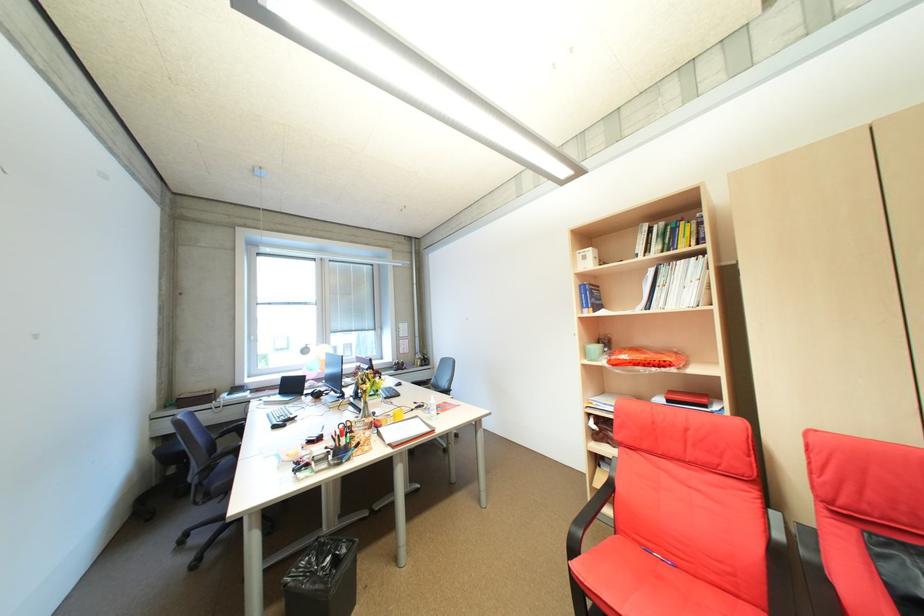
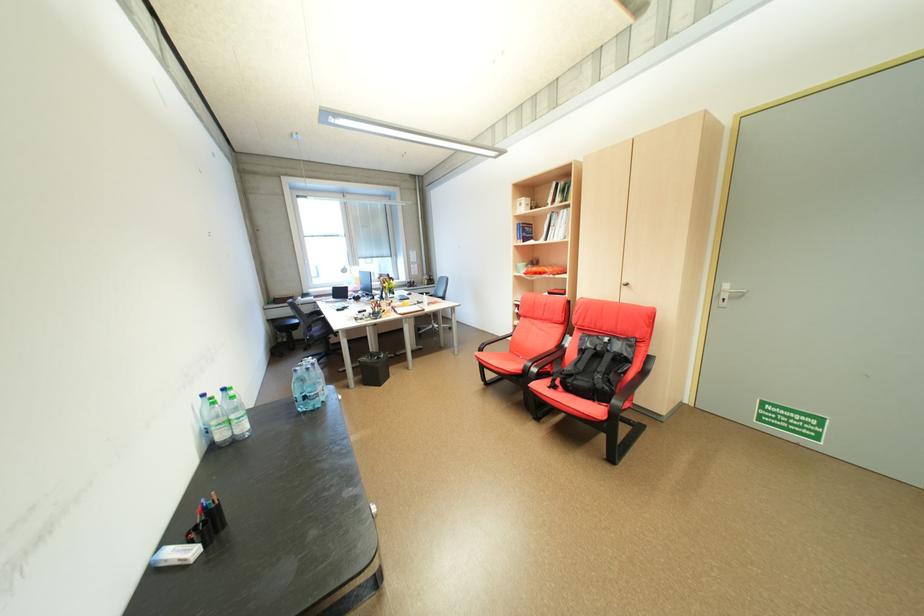
Find the pixel in the second image that matches [600,291] in the first image.

(532, 228)